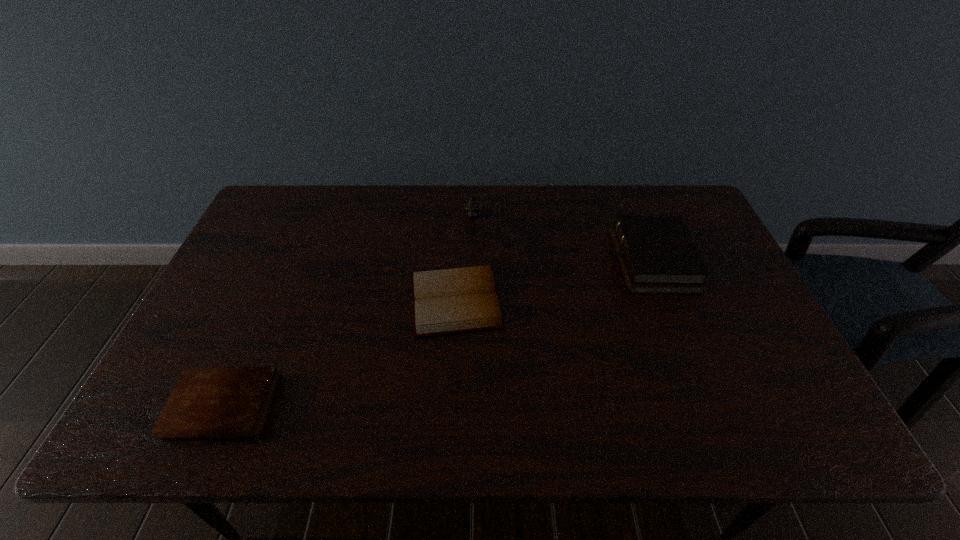
Locate an element on the screen. The image size is (960, 540). the farthest object is located at coordinates (472, 206).

Locate an element on the screen. the tallest object is located at coordinates (472, 206).

Locate an element on the screen. the second tallest object is located at coordinates (657, 255).

I want to click on the rightmost object, so click(x=657, y=255).

Identify the location of the second Bible from right to left. Image resolution: width=960 pixels, height=540 pixels. (446, 301).

This screenshot has height=540, width=960. I want to click on the nearest object, so click(207, 402).

This screenshot has height=540, width=960. What are the coordinates of `the nearest Bible` in the screenshot? It's located at pyautogui.click(x=207, y=402).

At what (x,y) coordinates should I click in order to perform the action: click on blank space located on the face of the tallest object. Please return your answer as a coordinate pair (x, y). The width and height of the screenshot is (960, 540). Looking at the image, I should click on (472, 260).

The height and width of the screenshot is (540, 960). In order to click on free region located 0.350m on the spine side of the rightmost object in this screenshot , I will do `click(498, 261)`.

The image size is (960, 540). In order to click on vacant point located on the spine side of the rightmost object in this screenshot , I will do `click(539, 261)`.